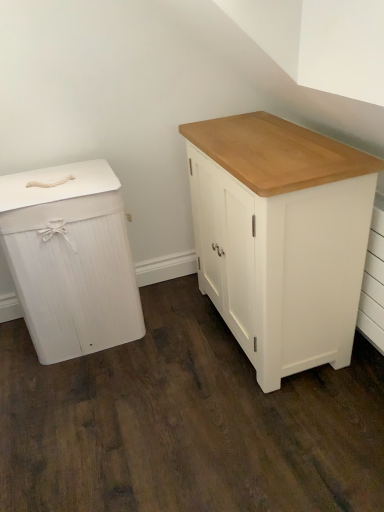
Where is `vacant space to the left of white painted wood cabinet at center, which is the 2th chest of drawers from left to right`? The image size is (384, 512). vacant space to the left of white painted wood cabinet at center, which is the 2th chest of drawers from left to right is located at coordinates (161, 352).